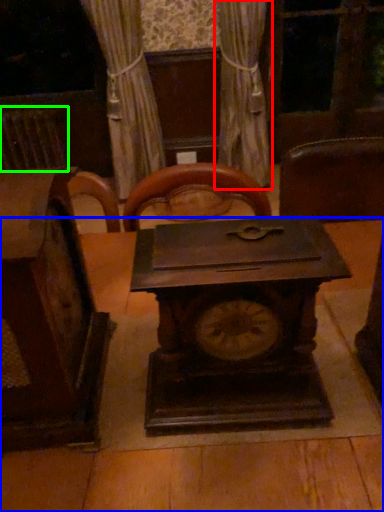
Question: Considering the real-world distances, which object is closest to curtain (highlighted by a red box)? table (highlighted by a blue box) or radiator (highlighted by a green box).

Choices:
 (A) table
 (B) radiator

Answer: (B)